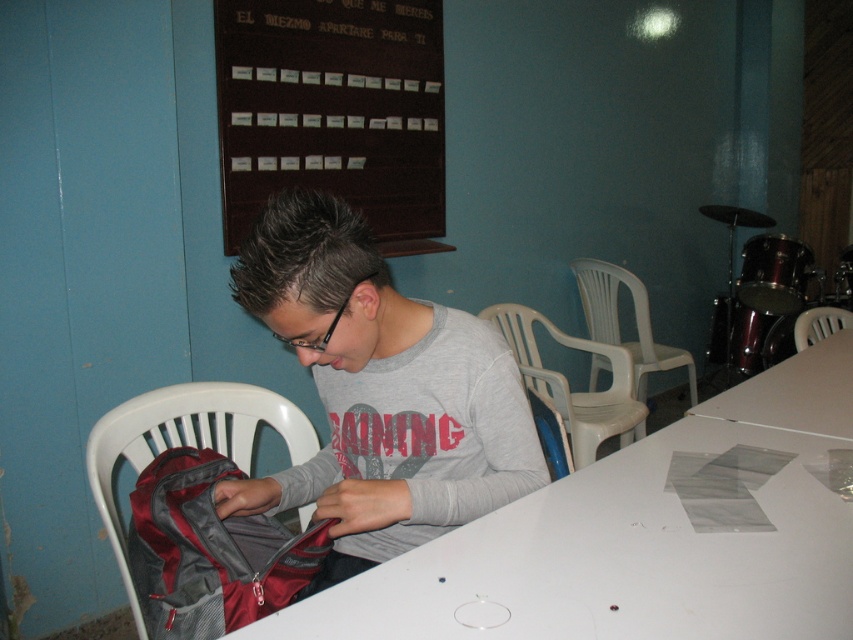
Question: Does white matte table at center have a smaller size compared to gray matte shirt at center?

Choices:
 (A) no
 (B) yes

Answer: (A)

Question: Does wooden plaque at upper center have a larger size compared to white matte table at lower right?

Choices:
 (A) yes
 (B) no

Answer: (A)

Question: Based on their relative distances, which object is nearer to the wooden plaque at upper center?

Choices:
 (A) white matte table at center
 (B) white plastic chair at upper right
 (C) white plastic chair at lower left
 (D) white plastic chair at center

Answer: (D)

Question: Which point appears closest to the camera in this image?

Choices:
 (A) (836, 328)
 (B) (392, 620)

Answer: (B)

Question: Can you confirm if white plastic chair at lower left is wider than white matte table at lower right?

Choices:
 (A) yes
 (B) no

Answer: (B)

Question: Among these objects, which one is nearest to the camera?

Choices:
 (A) white plastic chair at right
 (B) gray matte shirt at center
 (C) white matte table at center
 (D) white matte table at lower right

Answer: (C)